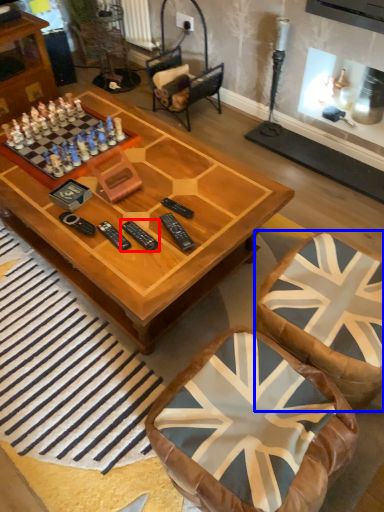
Question: Which object is closer to the camera taking this photo, remote (highlighted by a red box) or swivel chair (highlighted by a blue box)?

Choices:
 (A) remote
 (B) swivel chair

Answer: (B)